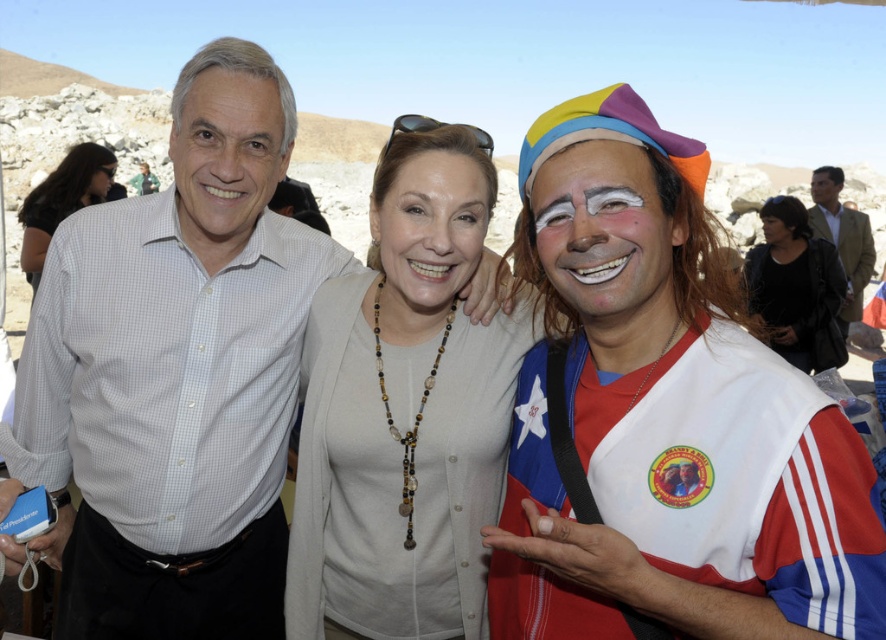
Is point (211, 131) in front of point (845, 257)?

Yes, it is.

This screenshot has height=640, width=886. Describe the element at coordinates (226, 156) in the screenshot. I see `matte white shirt at center` at that location.

Which is in front, point (278, 129) or point (832, 182)?

Point (278, 129) is in front.

Image resolution: width=886 pixels, height=640 pixels. What are the coordinates of `matte white shirt at center` in the screenshot? It's located at (226, 156).

Based on the photo, can you confirm if black leather jacket at center is thinner than matte black shirt at left?

No.

Find the location of a particular element. black leather jacket at center is located at coordinates (797, 291).

Does brown leather jacket at right lie behind smooth skin face at upper right?

No, brown leather jacket at right is closer to the viewer.

Is brown leather jacket at right in front of smooth skin face at upper right?

Yes, it is.

Between point (860, 232) and point (822, 195), which one is positioned in front?

Point (860, 232) is more forward.

I want to click on brown leather jacket at right, so click(x=842, y=236).